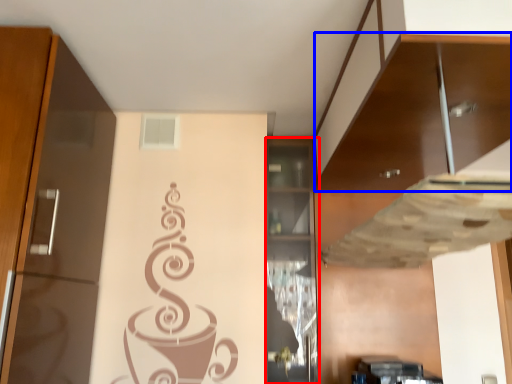
Question: Which object is further to the camera taking this photo, cabinetry (highlighted by a red box) or cabinetry (highlighted by a blue box)?

Choices:
 (A) cabinetry
 (B) cabinetry

Answer: (A)